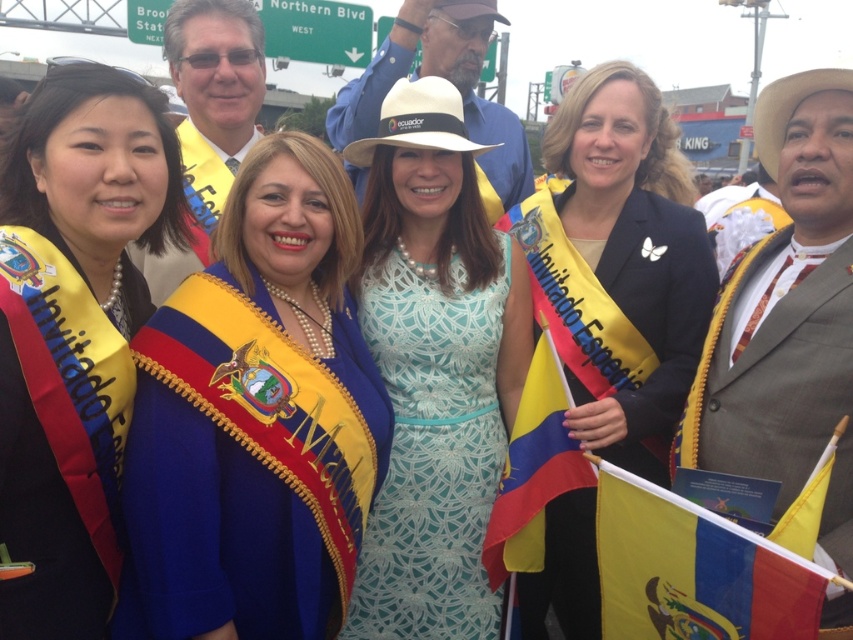
Who is shorter, blue satin sash at center or blue satin sash at left?

Standing shorter between the two is blue satin sash at left.

Consider the image. Who is taller, blue satin sash at center or blue satin sash at left?

blue satin sash at center is taller.

Describe the element at coordinates (256, 419) in the screenshot. Image resolution: width=853 pixels, height=640 pixels. I see `blue satin sash at center` at that location.

Find the location of a particular element. blue satin sash at center is located at coordinates (256, 419).

Is blue satin sash at left above yellowtextured fabricflag at center-right?

Incorrect, blue satin sash at left is not positioned above yellowtextured fabricflag at center-right.

Does point (12, 170) lie behind point (564, 451)?

No, (12, 170) is in front of (564, 451).

Locate an element on the screen. Image resolution: width=853 pixels, height=640 pixels. blue satin sash at left is located at coordinates (73, 337).

Is white lace dress at center below yellowtextured fabricflag at center-right?

Yes, white lace dress at center is below yellowtextured fabricflag at center-right.

Can you confirm if white lace dress at center is wider than yellowtextured fabricflag at center-right?

Incorrect, white lace dress at center's width does not surpass yellowtextured fabricflag at center-right's.

Image resolution: width=853 pixels, height=640 pixels. Describe the element at coordinates (434, 369) in the screenshot. I see `white lace dress at center` at that location.

Where is `white lace dress at center`? white lace dress at center is located at coordinates (434, 369).